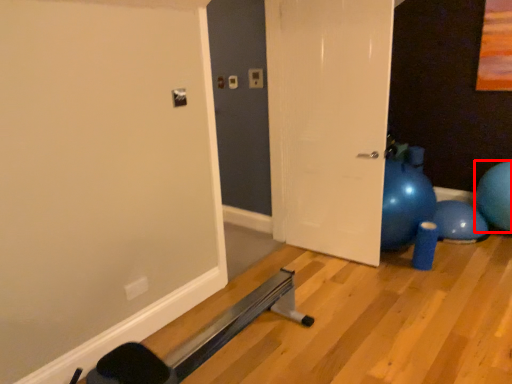
Question: In this image, where is ball (annotated by the red box) located relative to door?

Choices:
 (A) right
 (B) left

Answer: (A)